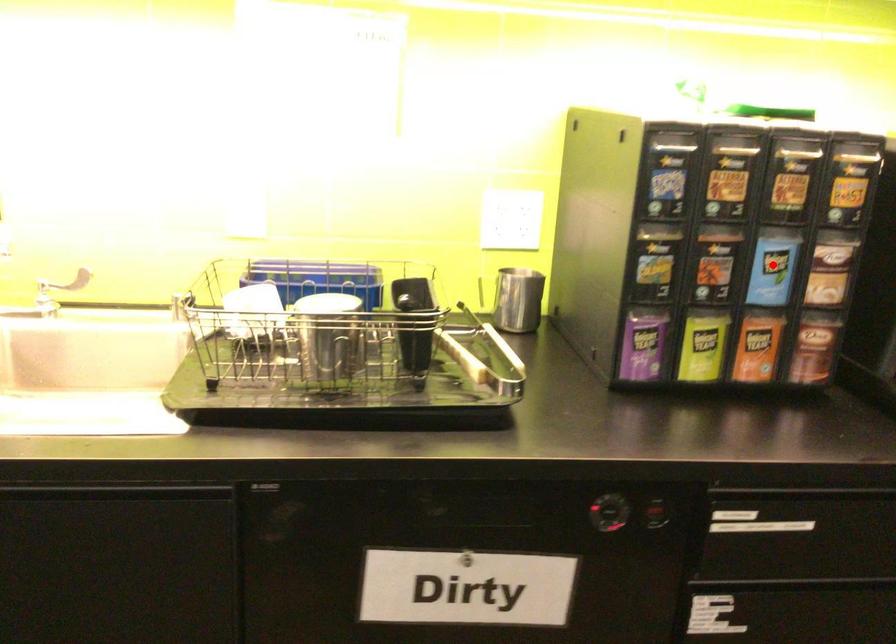
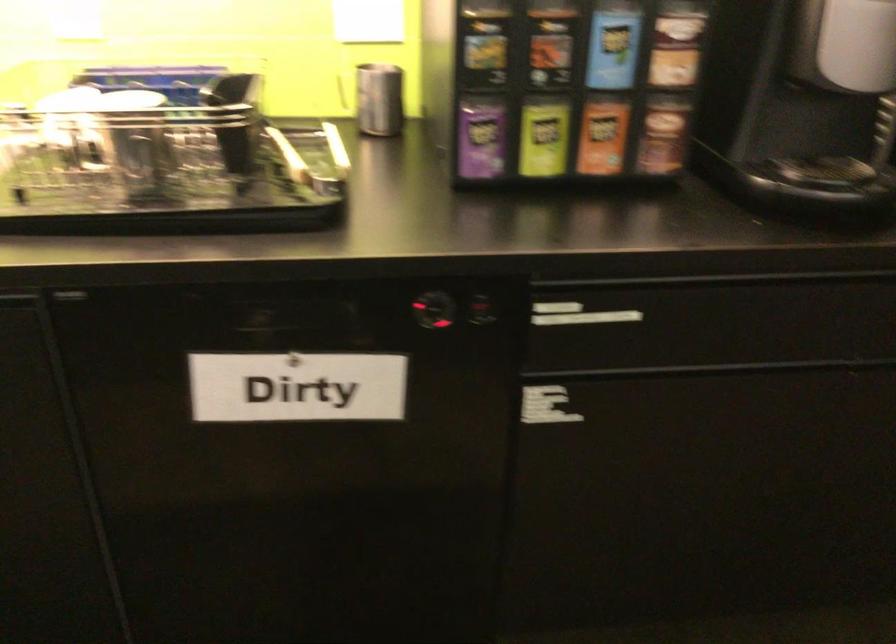
Locate, in the second image, the point that corresponds to the highlighted location in the first image.

(613, 44)